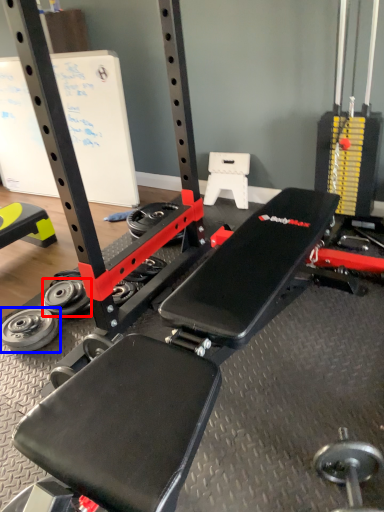
Question: Which of the following is the closest to the observer, wheel (highlighted by a red box) or wheel (highlighted by a blue box)?

Choices:
 (A) wheel
 (B) wheel

Answer: (B)